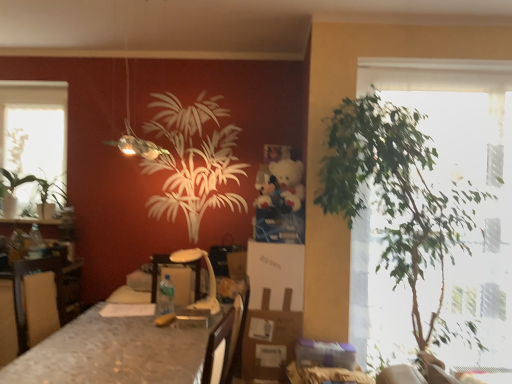
This screenshot has height=384, width=512. Describe the element at coordinates (397, 193) in the screenshot. I see `green leafy plant at right, which ranks as the first houseplant in front-to-back order` at that location.

What is the approximate height of green leafy plant at left?

31.14 inches.

Image resolution: width=512 pixels, height=384 pixels. In order to click on green leafy plant at left, the second houseplant viewed from the front in this screenshot , I will do (38, 185).

Between point (62, 195) and point (340, 214), which one is positioned in front?

Positioned in front is point (340, 214).

From the picture: Is green leafy plant at left, the second houseplant viewed from the front, facing away from green leafy plant at right, the second houseplant from the back?

That's not correct — green leafy plant at left, the second houseplant viewed from the front, is not looking away from green leafy plant at right, the second houseplant from the back.

Which is behind, green leafy plant at left, the second houseplant viewed from the front, or green leafy plant at right, which ranks as the first houseplant in front-to-back order?

green leafy plant at left, the second houseplant viewed from the front, is further away from the camera.

Would you say green leafy plant at left, which ranks as the 1th houseplant in left-to-right order, is outside green leafy plant at right, the 2th houseplant in the left-to-right sequence?

Indeed, green leafy plant at left, which ranks as the 1th houseplant in left-to-right order, is completely outside green leafy plant at right, the 2th houseplant in the left-to-right sequence.

Measure the distance from green leafy plant at right, which ranks as the first houseplant in front-to-back order, to green leafy plant at left.

The distance of green leafy plant at right, which ranks as the first houseplant in front-to-back order, from green leafy plant at left is 9.59 feet.

Can you tell me how much green leafy plant at right, the second houseplant from the back, and green leafy plant at left differ in facing direction?

There is a 3.06-degree angle between the facing directions of green leafy plant at right, the second houseplant from the back, and green leafy plant at left.

From a real-world perspective, is green leafy plant at right, which ranks as the first houseplant in front-to-back order, over green leafy plant at left?

No, from a real-world perspective, green leafy plant at right, which ranks as the first houseplant in front-to-back order, is not above green leafy plant at left.

Would you say green leafy plant at right, the second houseplant from the back, contains green leafy plant at left?

Actually, green leafy plant at left is outside green leafy plant at right, the second houseplant from the back.

The height and width of the screenshot is (384, 512). In order to click on table that is in front of the green leafy plant at left in this screenshot , I will do `click(111, 353)`.

Is marble-patterned table at center touching green leafy plant at left?

marble-patterned table at center is not next to green leafy plant at left, and they're not touching.

Is marble-patterned table at center turned away from green leafy plant at left?

No, marble-patterned table at center is not facing away from green leafy plant at left.

Which is farther, [319,201] or [147,358]?

The point [319,201] is farther.

Between green leafy plant at right, which is the first houseplant in right-to-left order, and marble-patterned table at center, which one has smaller size?

Smaller between the two is marble-patterned table at center.

From a real-world perspective, which is physically above, green leafy plant at right, which is the first houseplant in right-to-left order, or marble-patterned table at center?

In real-world perspective, green leafy plant at right, which is the first houseplant in right-to-left order, is above.

From the marble-patterned table at center, count 1st houseplants backward and point to it. Please provide its 2D coordinates.

[(397, 193)]

The image size is (512, 384). Identify the location of houseplant that is the 1st object located in front of the clear glass window at upper left. click(x=38, y=185).

Is point (27, 179) positioned in front of point (6, 127)?

Yes, it is in front of point (6, 127).

Which is more to the right, green leafy plant at left, which appears as the first houseplant when viewed from the back, or clear glass window at upper left?

From the viewer's perspective, green leafy plant at left, which appears as the first houseplant when viewed from the back, appears more on the right side.

Who is more distant, marble-patterned table at center or clear glass window at upper left?

clear glass window at upper left is more distant.

Does marble-patterned table at center have a larger size compared to clear glass window at upper left?

Correct, marble-patterned table at center is larger in size than clear glass window at upper left.

You are a GUI agent. You are given a task and a screenshot of the screen. Output one action in this format:
    pyautogui.click(x=<x>, y=<y>)
    Task: Click on the window on the left of marble-patterned table at center
    
    Given the screenshot: What is the action you would take?
    pyautogui.click(x=34, y=128)

Is marble-patterned table at center not close to clear glass window at upper left?

Absolutely, marble-patterned table at center is distant from clear glass window at upper left.

Measure the distance from green leafy plant at right, which is the first houseplant in right-to-left order, to clear glass window at upper left.

A distance of 2.73 meters exists between green leafy plant at right, which is the first houseplant in right-to-left order, and clear glass window at upper left.

Which is behind, point (355, 193) or point (30, 87)?

Point (30, 87)

Looking at the image, does green leafy plant at right, which is the first houseplant in right-to-left order, seem bigger or smaller compared to clear glass window at upper left?

Considering their sizes, green leafy plant at right, which is the first houseplant in right-to-left order, takes up more space than clear glass window at upper left.

What's the angular difference between green leafy plant at right, which is the first houseplant in right-to-left order, and clear glass window at upper left's facing directions?

The facing directions of green leafy plant at right, which is the first houseplant in right-to-left order, and clear glass window at upper left are 2.34 degrees apart.

Find the location of a particular element. Image resolution: width=512 pixels, height=384 pixels. houseplant located in front of the green leafy plant at left, which appears as the second houseplant when viewed from the right is located at coordinates (397, 193).

What are the coordinates of `plant above the green leafy plant at right, the second houseplant from the back (from a real-world perspective)` in the screenshot? It's located at pyautogui.click(x=15, y=164).

Based on the photo, based on their spatial positions, is green leafy plant at left or green leafy plant at right, which is the first houseplant in right-to-left order, closer to marble-patterned table at center?

Based on the image, green leafy plant at right, which is the first houseplant in right-to-left order, appears to be nearer to marble-patterned table at center.

When comparing their distances from green leafy plant at right, which ranks as the first houseplant in front-to-back order, does green leafy plant at left or marble-patterned table at center seem further?

The object further to green leafy plant at right, which ranks as the first houseplant in front-to-back order, is green leafy plant at left.

Which object lies further to the anchor point marble-patterned table at center, clear glass window at upper left or green leafy plant at right, the 2th houseplant in the left-to-right sequence?

clear glass window at upper left lies further to marble-patterned table at center than the other object.

Estimate the real-world distances between objects in this image. Which object is further from green leafy plant at left, marble-patterned table at center or green leafy plant at left, the second houseplant viewed from the front?

marble-patterned table at center is positioned further to the anchor green leafy plant at left.

Based on their spatial positions, is clear glass window at upper left or marble-patterned table at center closer to green leafy plant at right, which ranks as the first houseplant in front-to-back order?

marble-patterned table at center.

Based on their spatial positions, is green leafy plant at right, which ranks as the first houseplant in front-to-back order, or green leafy plant at left closer to green leafy plant at left, the second houseplant viewed from the front?

green leafy plant at left is closer to green leafy plant at left, the second houseplant viewed from the front.

Looking at the image, which one is located closer to green leafy plant at left, green leafy plant at right, the 2th houseplant in the left-to-right sequence, or marble-patterned table at center?

marble-patterned table at center is positioned closer to the anchor green leafy plant at left.

Consider the image. Which object lies further to the anchor point clear glass window at upper left, green leafy plant at left or marble-patterned table at center?

The object further to clear glass window at upper left is marble-patterned table at center.

Where is `table between green leafy plant at left, which ranks as the 1th houseplant in left-to-right order, and green leafy plant at right, the second houseplant from the back, in the horizontal direction`? table between green leafy plant at left, which ranks as the 1th houseplant in left-to-right order, and green leafy plant at right, the second houseplant from the back, in the horizontal direction is located at coordinates (111, 353).

I want to click on table located between clear glass window at upper left and green leafy plant at right, the second houseplant from the back, in the left-right direction, so click(111, 353).

The height and width of the screenshot is (384, 512). In order to click on houseplant between clear glass window at upper left and green leafy plant at right, the second houseplant from the back, from left to right in this screenshot , I will do `click(38, 185)`.

Image resolution: width=512 pixels, height=384 pixels. What are the coordinates of `houseplant between green leafy plant at left and green leafy plant at right, which is the first houseplant in right-to-left order` in the screenshot? It's located at (38, 185).